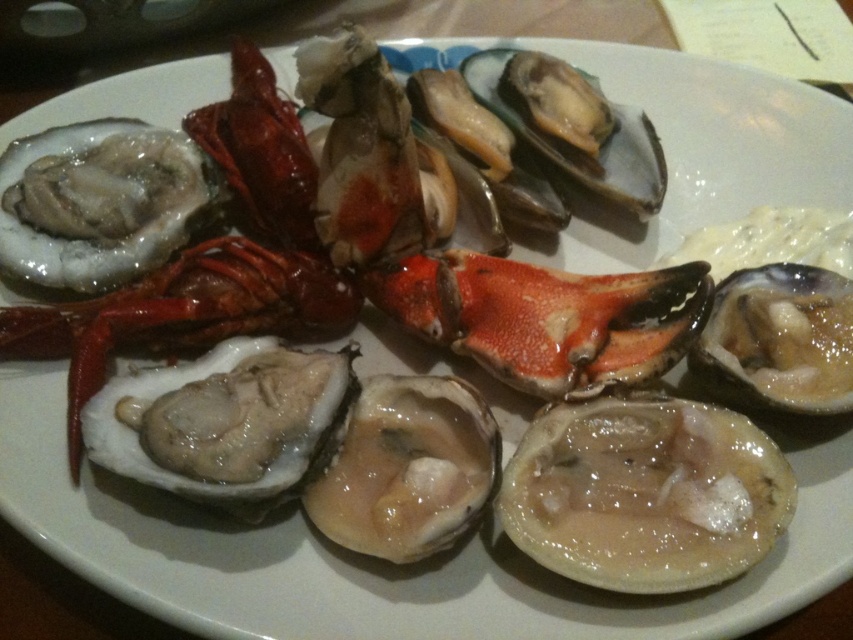
Question: Does shiny red lobster at center have a larger size compared to translucent shell oyster at center?

Choices:
 (A) yes
 (B) no

Answer: (A)

Question: Among these objects, which one is farthest from the camera?

Choices:
 (A) white glossy oyster at upper left
 (B) shiny red lobster at center

Answer: (A)

Question: Can you confirm if translucent gelatinous shellfish at center is positioned to the left of white glossy oyster at upper left?

Choices:
 (A) no
 (B) yes

Answer: (A)

Question: Among these objects, which one is farthest from the camera?

Choices:
 (A) translucent gelatinous shellfish at center
 (B) translucent shell oyster at center
 (C) white glossy oyster at upper left

Answer: (C)

Question: Can you confirm if white glossy oyster at upper left is positioned to the left of shiny red lobster at center?

Choices:
 (A) yes
 (B) no

Answer: (A)

Question: Which of the following is the farthest from the observer?

Choices:
 (A) (831, 394)
 (B) (74, 280)

Answer: (B)